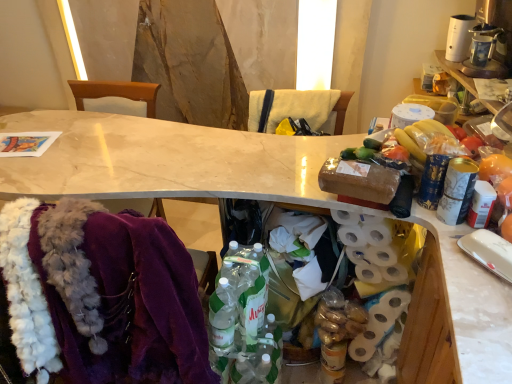
Question: Should I look upward or downward to see yellow fabric at upper center?

Choices:
 (A) up
 (B) down

Answer: (A)

Question: Does yellow fabric at upper center have a greater height compared to translucent plastic bottles at center?

Choices:
 (A) yes
 (B) no

Answer: (B)

Question: From a real-world perspective, is yellow fabric at upper center under translucent plastic bottles at center?

Choices:
 (A) no
 (B) yes

Answer: (A)

Question: Can you confirm if yellow fabric at upper center is wider than translucent plastic bottles at center?

Choices:
 (A) yes
 (B) no

Answer: (A)

Question: Is the position of yellow fabric at upper center more distant than that of translucent plastic bottles at center?

Choices:
 (A) yes
 (B) no

Answer: (A)

Question: Can you confirm if yellow fabric at upper center is thinner than translucent plastic bottles at center?

Choices:
 (A) yes
 (B) no

Answer: (B)

Question: Can you see yellow fabric at upper center touching translucent plastic bottles at center?

Choices:
 (A) yes
 (B) no

Answer: (B)

Question: From the image's perspective, does white matte toilet paper at right appear lower than white marble desk at center?

Choices:
 (A) yes
 (B) no

Answer: (A)

Question: From the image's perspective, does white matte toilet paper at right appear higher than white marble desk at center?

Choices:
 (A) yes
 (B) no

Answer: (B)

Question: Considering the relative sizes of white matte toilet paper at right and white marble desk at center in the image provided, is white matte toilet paper at right taller than white marble desk at center?

Choices:
 (A) no
 (B) yes

Answer: (A)

Question: Is white matte toilet paper at right placed right next to white marble desk at center?

Choices:
 (A) no
 (B) yes

Answer: (A)

Question: Can you confirm if white matte toilet paper at right is thinner than white marble desk at center?

Choices:
 (A) no
 (B) yes

Answer: (B)

Question: Is white matte toilet paper at right surrounding white marble desk at center?

Choices:
 (A) no
 (B) yes

Answer: (A)

Question: Is white marble desk at center closer to the viewer compared to purple fabric chair at left, positioned as the 2th chair in right-to-left order?

Choices:
 (A) no
 (B) yes

Answer: (B)